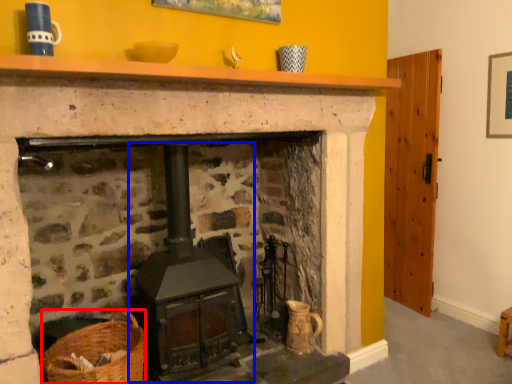
Question: Which object is closer to the camera taking this photo, basket (highlighted by a red box) or stove (highlighted by a blue box)?

Choices:
 (A) basket
 (B) stove

Answer: (A)